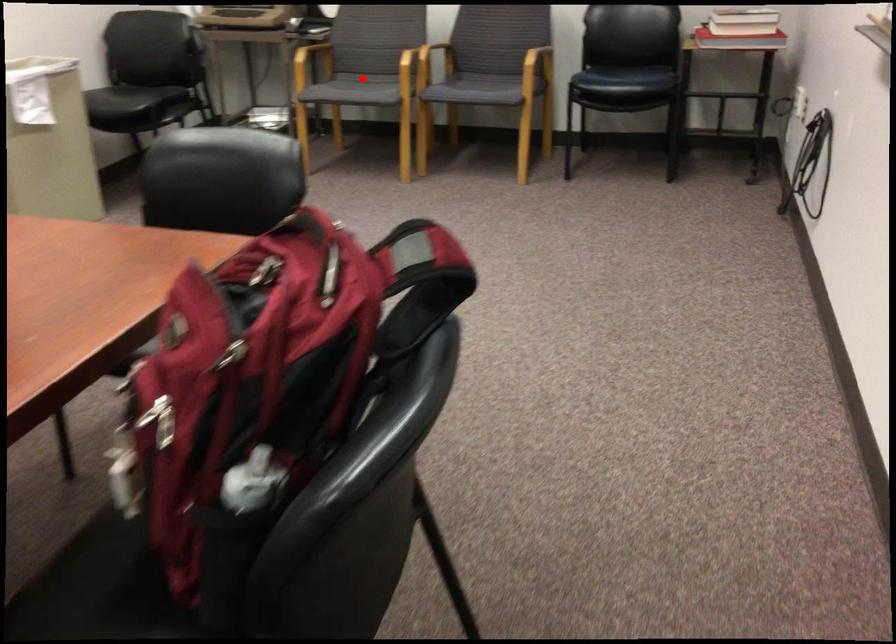
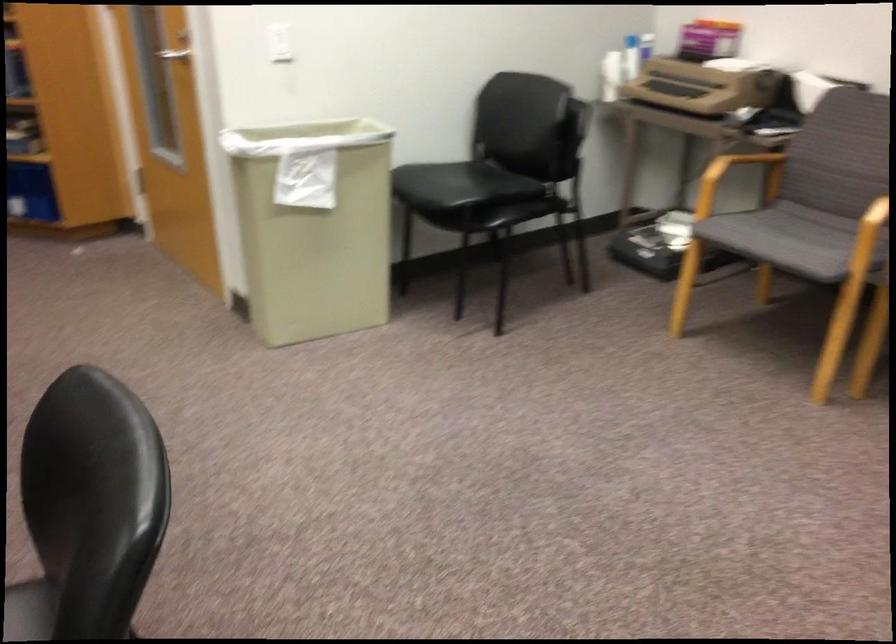
Question: I am providing you with two images of the same scene from different viewpoints. A red point is marked on the first image. Can you still see the location of the red point in image 2?

Choices:
 (A) Yes
 (B) No

Answer: (A)